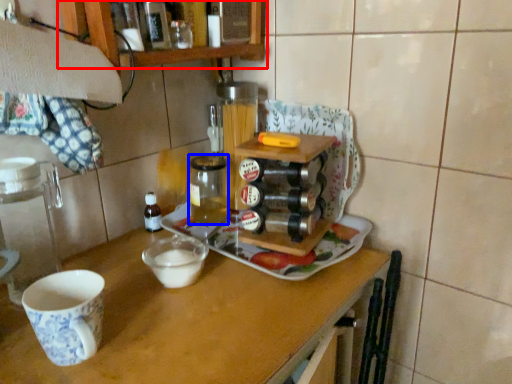
Question: Which object is closer to the camera taking this photo, cabinetry (highlighted by a red box) or beverage (highlighted by a blue box)?

Choices:
 (A) cabinetry
 (B) beverage

Answer: (A)